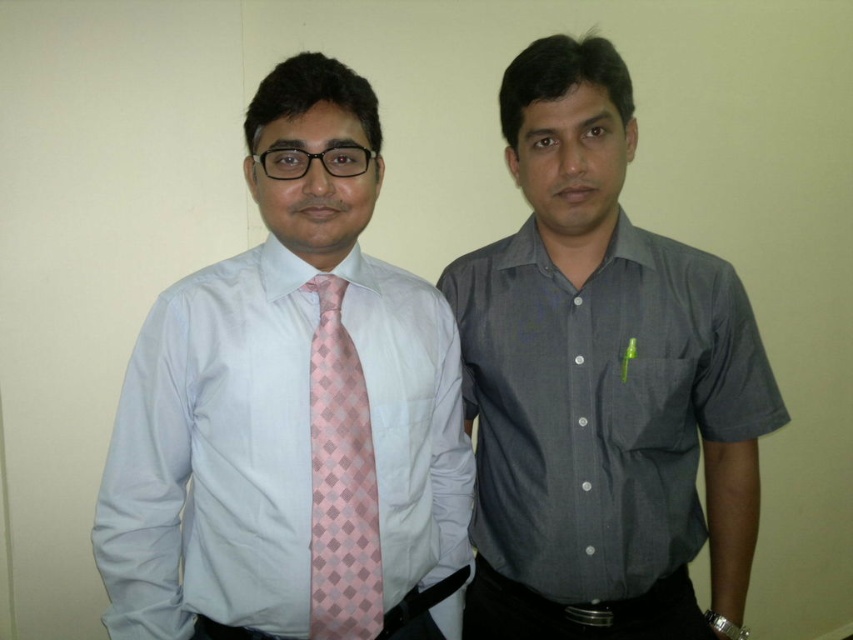
Question: Can you confirm if pink silk tie at left is positioned above black leather belt at lower center?

Choices:
 (A) no
 (B) yes

Answer: (B)

Question: Can you confirm if matte pink tie at left is positioned to the left of black leather belt at lower center?

Choices:
 (A) no
 (B) yes

Answer: (B)

Question: Is pink silk tie at left thinner than black leather belt at lower center?

Choices:
 (A) no
 (B) yes

Answer: (B)

Question: Estimate the real-world distances between objects in this image. Which object is farther from the pink silk tie at left?

Choices:
 (A) black leather belt at lower center
 (B) dark gray shirt at center
 (C) matte pink tie at left

Answer: (A)

Question: Which of the following is the closest to the observer?

Choices:
 (A) pink silk tie at left
 (B) matte pink tie at left
 (C) black leather belt at lower center
 (D) dark gray shirt at center

Answer: (B)

Question: Estimate the real-world distances between objects in this image. Which object is farther from the matte pink tie at left?

Choices:
 (A) black leather belt at lower center
 (B) pink silk tie at left
 (C) dark gray shirt at center

Answer: (A)